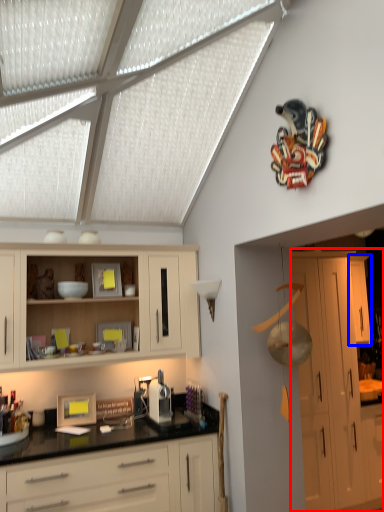
Question: Which of the following is the closest to the observer, cabinetry (highlighted by a red box) or cabinetry (highlighted by a blue box)?

Choices:
 (A) cabinetry
 (B) cabinetry

Answer: (A)